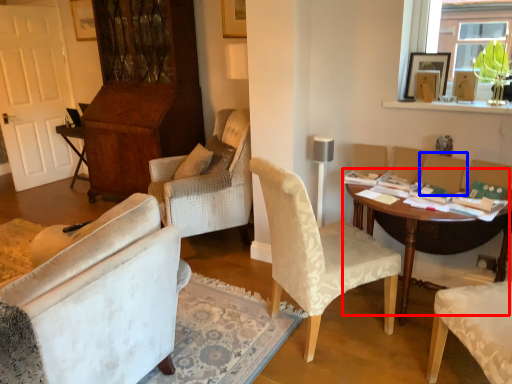
Question: Among these objects, which one is farthest to the camera, table (highlighted by a red box) or armchair (highlighted by a blue box)?

Choices:
 (A) table
 (B) armchair

Answer: (B)